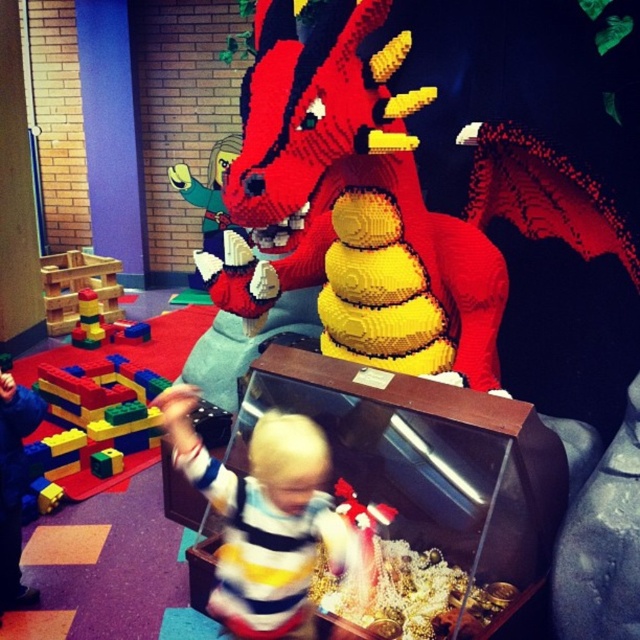
You are a parent trying to decide whether to let your child wear their striped cotton shirt at center while playing with wooden blocks at left. Considering the sizes of the objects, will the shirt be large enough to cover the blocks?

The striped cotton shirt at center has a lesser width compared to wooden blocks at left, so the shirt may not be wide enough to fully cover the wooden blocks at left.

You are a parent trying to ensure your child can safely reach the LEGO treasure inside the dragon without touching the dragon itself. The dragon is at the center of the room, and the child is wearing a striped cotton shirt at center. How far apart are the child and the dragon?

The striped cotton shirt at center and the dragon are 1.40 meters apart.